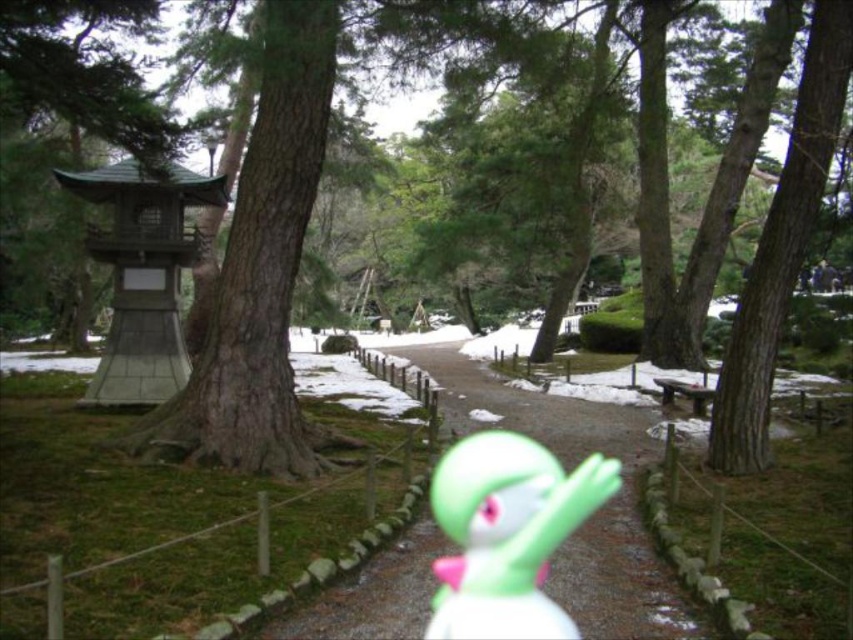
Question: Which is farther from the green matte tree at center?

Choices:
 (A) green rubber toy at center
 (B) smooth concrete path at center

Answer: (A)

Question: Based on their relative distances, which object is nearer to the green matte tree at center?

Choices:
 (A) green rubber toy at center
 (B) smooth concrete path at center

Answer: (B)

Question: Does green matte tree at center appear under smooth concrete path at center?

Choices:
 (A) no
 (B) yes

Answer: (A)

Question: Which object appears closest to the camera in this image?

Choices:
 (A) green rubber toy at center
 (B) green matte tree at center

Answer: (B)

Question: Can you confirm if smooth concrete path at center is bigger than green rubber toy at center?

Choices:
 (A) no
 (B) yes

Answer: (B)

Question: Is smooth concrete path at center behind green rubber toy at center?

Choices:
 (A) yes
 (B) no

Answer: (B)